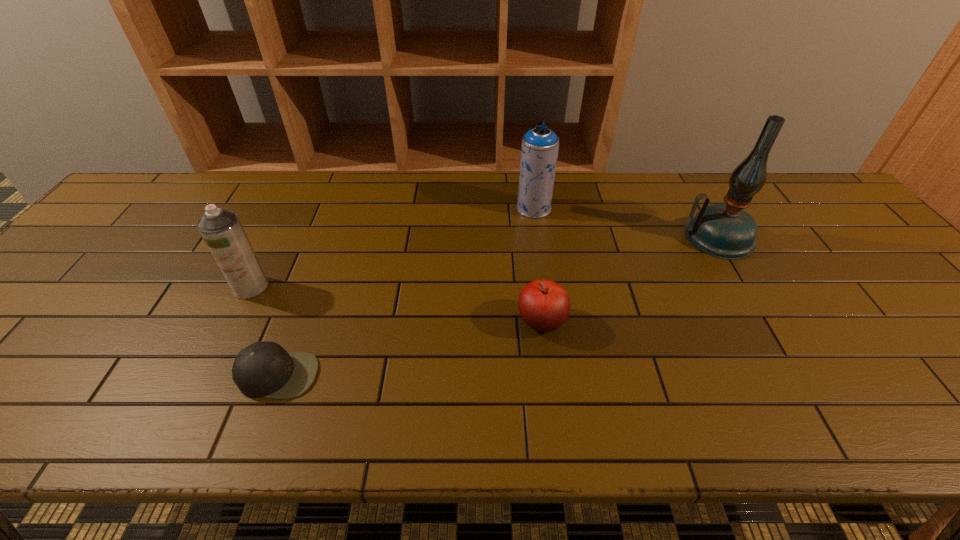
You are a GUI agent. You are given a task and a screenshot of the screen. Output one action in this format:
    pyautogui.click(x=<x>, y=<y>)
    Task: Click on the vacant area that lies between the third nearest object and the farther aerosol can
    The image size is (960, 540).
    Given the screenshot: What is the action you would take?
    pyautogui.click(x=393, y=247)

You are a GUI agent. You are given a task and a screenshot of the screen. Output one action in this format:
    pyautogui.click(x=<x>, y=<y>)
    Task: Click on the vacant point located between the second nearest object and the shortest object
    The height and width of the screenshot is (540, 960).
    Given the screenshot: What is the action you would take?
    pyautogui.click(x=410, y=348)

What are the coordinates of `free spot between the nearest object and the second shortest object` in the screenshot? It's located at (410, 348).

Locate an element on the screen. object that stands as the third closest to the right aerosol can is located at coordinates (265, 369).

You are a GUI agent. You are given a task and a screenshot of the screen. Output one action in this format:
    pyautogui.click(x=<x>, y=<y>)
    Task: Click on the object that is the fourth closest to the right aerosol can
    The width and height of the screenshot is (960, 540).
    Given the screenshot: What is the action you would take?
    pyautogui.click(x=222, y=231)

The height and width of the screenshot is (540, 960). Find the location of `vacant area that satisfies the following two spatial constraints: 1. on the back side of the right aerosol can; 2. on the left side of the leftmost object`. vacant area that satisfies the following two spatial constraints: 1. on the back side of the right aerosol can; 2. on the left side of the leftmost object is located at coordinates (291, 208).